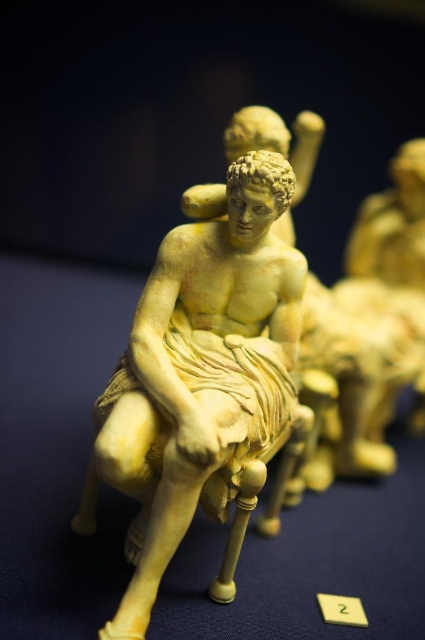
Which is behind, point (190, 451) or point (348, 612)?

The point (348, 612) is more distant.

Where is `matte yellow statue at center`? This screenshot has height=640, width=425. matte yellow statue at center is located at coordinates (201, 378).